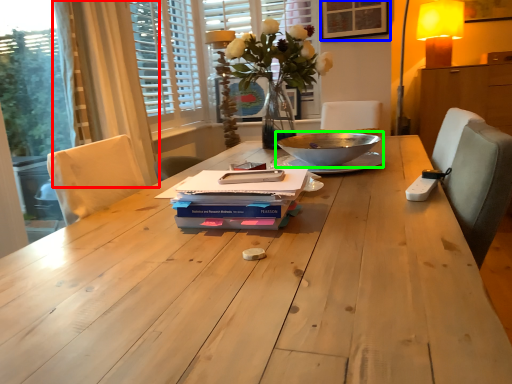
Question: Which is nearer to the curtain (highlighted by a red box)? picture frame (highlighted by a blue box) or bowl (highlighted by a green box).

Choices:
 (A) picture frame
 (B) bowl

Answer: (B)